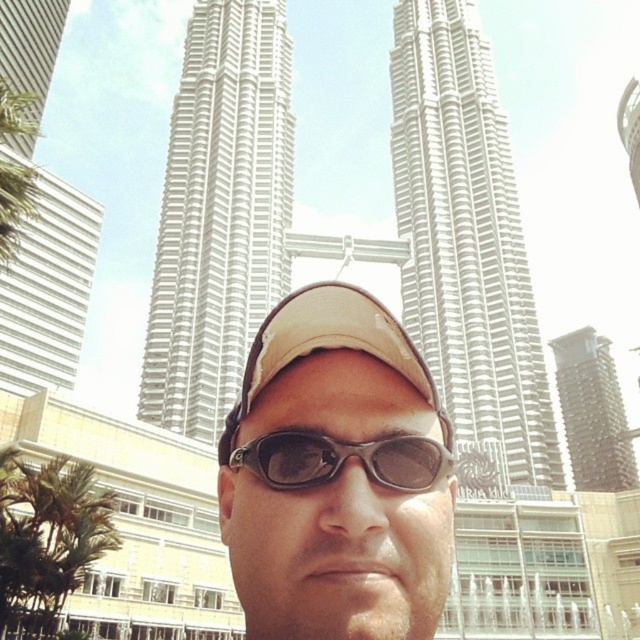
The width and height of the screenshot is (640, 640). Identify the location of white smooth tower at center. (467, 237).

From the picture: Measure the distance between white smooth tower at center and dark brown textured building at right.

A distance of 244.58 feet exists between white smooth tower at center and dark brown textured building at right.

You are a GUI agent. You are given a task and a screenshot of the screen. Output one action in this format:
    pyautogui.click(x=<x>, y=<y>)
    Task: Click on the white smooth tower at center
    The image size is (640, 640).
    Given the screenshot: What is the action you would take?
    pyautogui.click(x=467, y=237)

Who is more distant from viewer, (257,417) or (525,269)?

The point (525,269) is behind.

Is matte beige cap at center bigger than white smooth tower at center?

Actually, matte beige cap at center might be smaller than white smooth tower at center.

Where is `matte beige cap at center`? The width and height of the screenshot is (640, 640). matte beige cap at center is located at coordinates (336, 477).

Is point (435, 573) positioned before point (248, 74)?

Yes, point (435, 573) is closer to viewer.

Does matte beige cap at center appear over white metallic tower at center?

No, matte beige cap at center is not above white metallic tower at center.

Locate an element on the screen. The image size is (640, 640). matte beige cap at center is located at coordinates (336, 477).